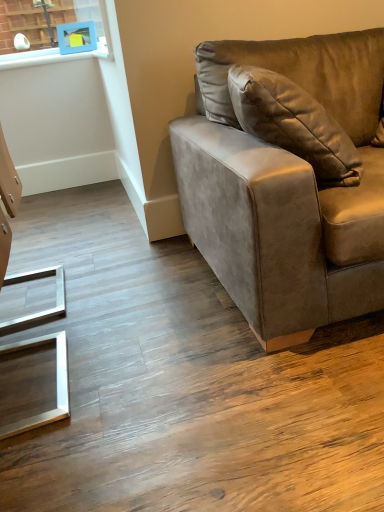
Image resolution: width=384 pixels, height=512 pixels. What do you see at coordinates (287, 189) in the screenshot?
I see `suede-like brown couch at right` at bounding box center [287, 189].

Measure the distance between suede-like brown couch at right and camera.

A distance of 3.31 feet exists between suede-like brown couch at right and camera.

What are the coordinates of `suede-like brown couch at right` in the screenshot? It's located at (287, 189).

This screenshot has width=384, height=512. What do you see at coordinates (77, 37) in the screenshot? I see `blue plastic picture frame at upper left` at bounding box center [77, 37].

I want to click on blue plastic picture frame at upper left, so click(77, 37).

Locate an element on the screen. suede-like brown couch at right is located at coordinates (287, 189).

Considering the positions of objects suede-like brown couch at right and blue plastic picture frame at upper left in the image provided, who is more to the left, suede-like brown couch at right or blue plastic picture frame at upper left?

blue plastic picture frame at upper left is more to the left.

In the scene shown: Is the position of suede-like brown couch at right less distant than that of blue plastic picture frame at upper left?

That is True.

Considering the positions of points (362, 126) and (81, 45), is point (362, 126) closer to camera compared to point (81, 45)?

That is True.

From the image's perspective, does suede-like brown couch at right appear lower than blue plastic picture frame at upper left?

Yes, from the image's perspective, suede-like brown couch at right is beneath blue plastic picture frame at upper left.

From a real-world perspective, who is located lower, suede-like brown couch at right or blue plastic picture frame at upper left?

suede-like brown couch at right.

Is suede-like brown couch at right thinner than blue plastic picture frame at upper left?

No.

Considering the sizes of objects suede-like brown couch at right and blue plastic picture frame at upper left in the image provided, who is shorter, suede-like brown couch at right or blue plastic picture frame at upper left?

With less height is blue plastic picture frame at upper left.

Looking at the image, does suede-like brown couch at right seem bigger or smaller compared to blue plastic picture frame at upper left?

Considering their sizes, suede-like brown couch at right takes up more space than blue plastic picture frame at upper left.

Is suede-like brown couch at right inside the boundaries of blue plastic picture frame at upper left, or outside?

suede-like brown couch at right cannot be found inside blue plastic picture frame at upper left.

Is suede-like brown couch at right far from blue plastic picture frame at upper left?

Absolutely, suede-like brown couch at right is distant from blue plastic picture frame at upper left.

Is suede-like brown couch at right positioned with its back to blue plastic picture frame at upper left?

Yes, suede-like brown couch at right is facing away from blue plastic picture frame at upper left.

Measure the distance from suede-like brown couch at right to blue plastic picture frame at upper left.

suede-like brown couch at right and blue plastic picture frame at upper left are 1.84 meters apart from each other.

Find the location of a particular element. studio couch below the blue plastic picture frame at upper left (from a real-world perspective) is located at coordinates coord(287,189).

Can you confirm if blue plastic picture frame at upper left is positioned to the left of suede-like brown couch at right?

Indeed, blue plastic picture frame at upper left is positioned on the left side of suede-like brown couch at right.

Does blue plastic picture frame at upper left come behind suede-like brown couch at right?

Yes, it is.

Is point (94, 46) less distant than point (275, 229)?

No, it is not.

From the image's perspective, which one is positioned lower, blue plastic picture frame at upper left or suede-like brown couch at right?

suede-like brown couch at right, from the image's perspective.

From a real-world perspective, which object rests below the other?

suede-like brown couch at right, from a real-world perspective.

Considering the sizes of objects blue plastic picture frame at upper left and suede-like brown couch at right in the image provided, who is wider, blue plastic picture frame at upper left or suede-like brown couch at right?

Wider between the two is suede-like brown couch at right.

Is blue plastic picture frame at upper left taller than suede-like brown couch at right?

Incorrect, the height of blue plastic picture frame at upper left is not larger of that of suede-like brown couch at right.

Considering the sizes of objects blue plastic picture frame at upper left and suede-like brown couch at right in the image provided, who is smaller, blue plastic picture frame at upper left or suede-like brown couch at right?

With smaller size is blue plastic picture frame at upper left.

Is blue plastic picture frame at upper left located outside suede-like brown couch at right?

Yes.

Is blue plastic picture frame at upper left in contact with suede-like brown couch at right?

No, blue plastic picture frame at upper left is not next to suede-like brown couch at right.

Is blue plastic picture frame at upper left positioned with its back to suede-like brown couch at right?

That's not correct — blue plastic picture frame at upper left is not looking away from suede-like brown couch at right.

In the image, there is a blue plastic picture frame at upper left. Where is `studio couch below it (from the image's perspective)`? This screenshot has width=384, height=512. studio couch below it (from the image's perspective) is located at coordinates (287, 189).

Find the location of a particular element. picture frame behind the suede-like brown couch at right is located at coordinates (77, 37).

Where is `studio couch located on the right of blue plastic picture frame at upper left`? Image resolution: width=384 pixels, height=512 pixels. studio couch located on the right of blue plastic picture frame at upper left is located at coordinates (287, 189).